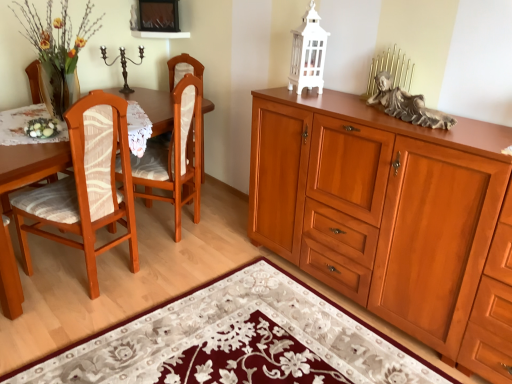
Locate an element on the screen. vacant space in between wooden cabinet at right and wooden chair at left, arranged as the 1th chair when viewed from the back is located at coordinates (245, 266).